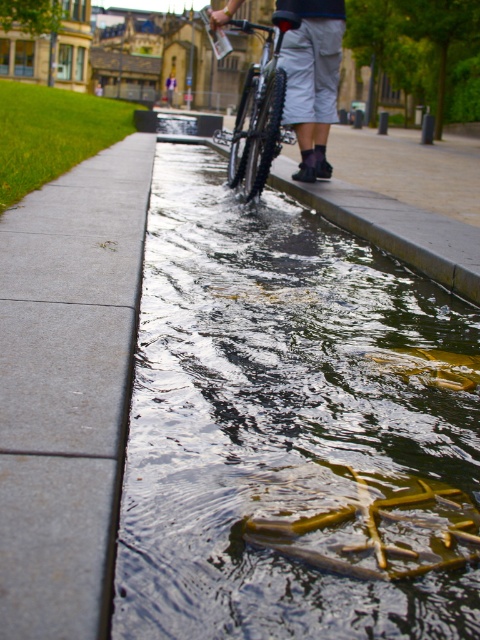
You are a delivery person carrying a heavy package and need to cross the area shown in the image. The clear water at center and the gray concrete sidewalk at left are both potential paths. Which path should you choose to avoid getting your package wet?

You should choose the gray concrete sidewalk at left because the clear water at center is located below it, meaning the sidewalk is above the water and less likely to get your package wet.

You are standing at the point marked as point (282, 419) in the image. Based on the scene description, what surface are you currently standing on?

The point (282, 419) is on clear water at center, so you are standing on clear water at center.